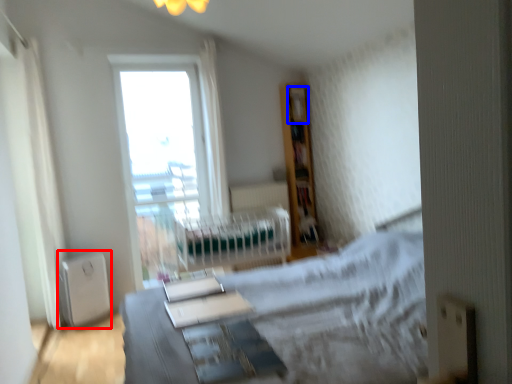
Question: Which object appears closest to the camera in this image, appliance (highlighted by a red box) or shelf (highlighted by a blue box)?

Choices:
 (A) appliance
 (B) shelf

Answer: (A)